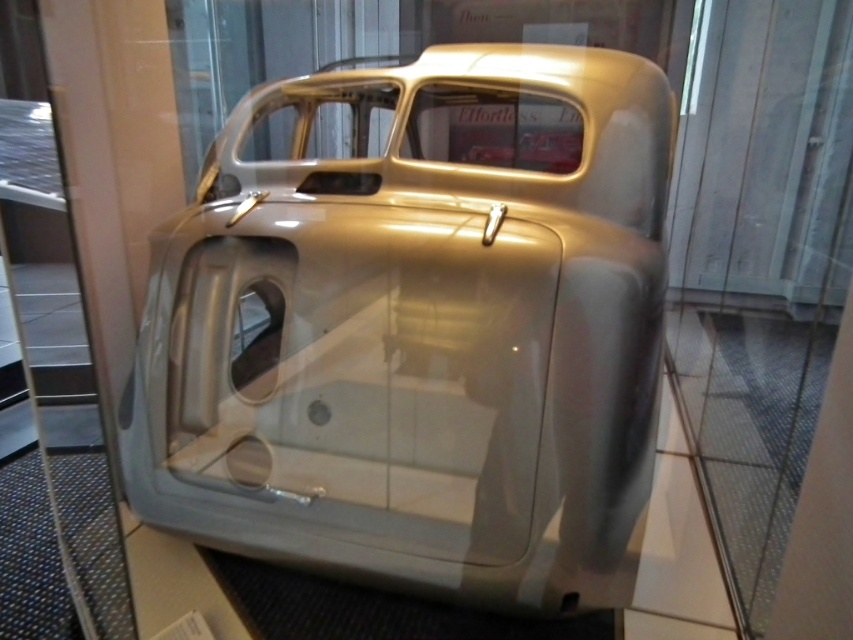
Question: Which object appears farthest from the camera in this image?

Choices:
 (A) transparent glass door at center
 (B) metallic silver car at center

Answer: (A)

Question: Does metallic silver car at center appear over transparent glass door at center?

Choices:
 (A) yes
 (B) no

Answer: (B)

Question: Among these objects, which one is nearest to the camera?

Choices:
 (A) metallic silver car at center
 (B) transparent glass door at center

Answer: (A)

Question: Observing the image, what is the correct spatial positioning of metallic silver car at center in reference to transparent glass door at center?

Choices:
 (A) above
 (B) below

Answer: (B)

Question: Which of the following is the closest to the observer?

Choices:
 (A) metallic silver car at center
 (B) transparent glass door at center

Answer: (A)

Question: Can you confirm if metallic silver car at center is thinner than transparent glass door at center?

Choices:
 (A) no
 (B) yes

Answer: (B)